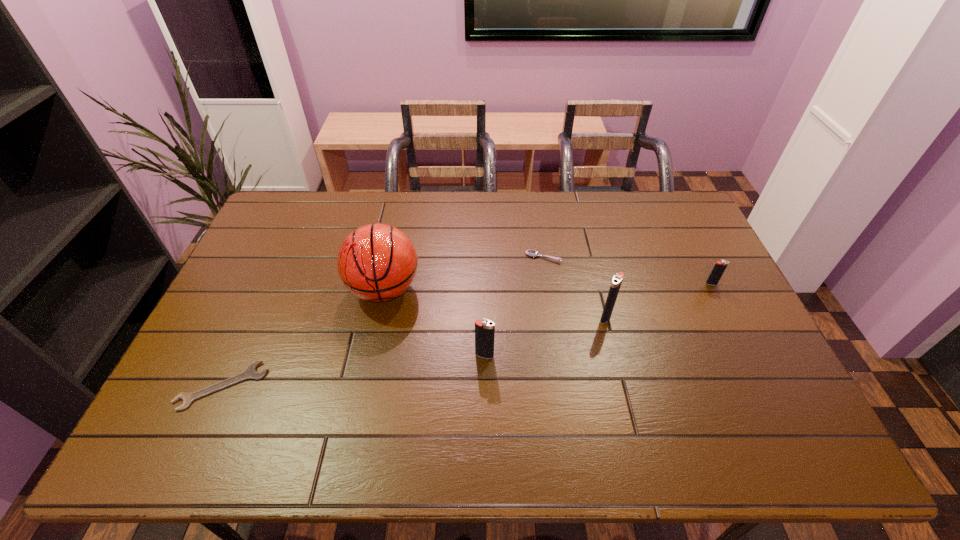
Image resolution: width=960 pixels, height=540 pixels. I want to click on object that is at the right edge, so click(720, 266).

The width and height of the screenshot is (960, 540). In order to click on object that is at the near left corner in this screenshot , I will do `click(250, 373)`.

Image resolution: width=960 pixels, height=540 pixels. Find the location of `vacant space at the far edge of the desktop`. vacant space at the far edge of the desktop is located at coordinates (359, 224).

In the image, there is a desktop. At what (x,y) coordinates should I click in order to perform the action: click on vacant area at the near edge. Please return your answer as a coordinate pair (x, y). Looking at the image, I should click on (369, 404).

At what (x,y) coordinates should I click in order to perform the action: click on free space at the right edge of the desktop. Please return your answer as a coordinate pair (x, y). Looking at the image, I should click on (682, 279).

Find the location of a particular element. The image size is (960, 540). free space at the far left corner of the desktop is located at coordinates (293, 199).

In the image, there is a desktop. Where is `blank space at the near left corner`? Image resolution: width=960 pixels, height=540 pixels. blank space at the near left corner is located at coordinates (165, 414).

You are a GUI agent. You are given a task and a screenshot of the screen. Output one action in this format:
    pyautogui.click(x=<x>, y=<y>)
    Task: Click on the free space at the far right corner of the desktop
    Image resolution: width=960 pixels, height=540 pixels.
    Given the screenshot: What is the action you would take?
    pyautogui.click(x=645, y=198)

Locate an element on the screen. The image size is (960, 540). free point between the second igniter from left to right and the rightmost igniter is located at coordinates (659, 300).

Where is `unoccupied position between the third object from left to right and the third shortest object`? The height and width of the screenshot is (540, 960). unoccupied position between the third object from left to right and the third shortest object is located at coordinates (598, 320).